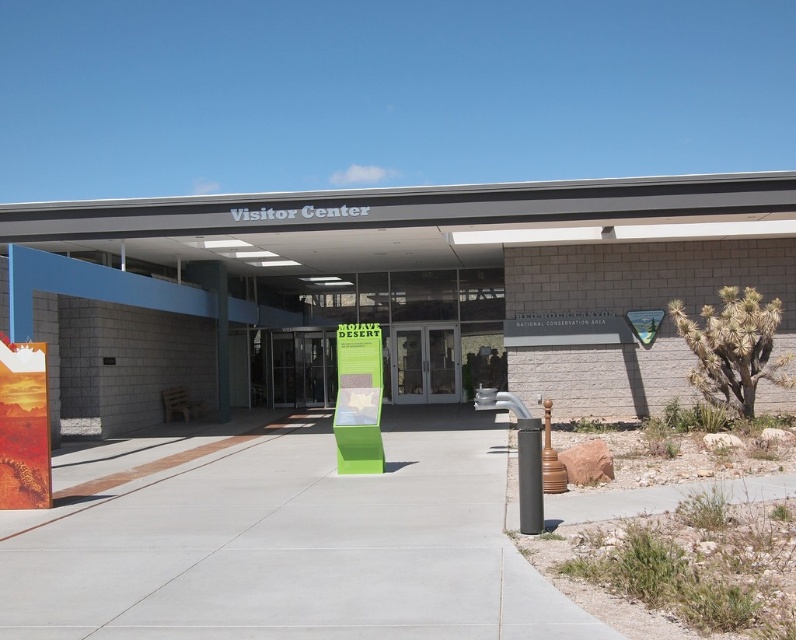
Can you confirm if clear glass doors at center is positioned above black smooth pole at lower right?

Yes.

Is point (404, 346) closer to viewer compared to point (521, 458)?

No.

The height and width of the screenshot is (640, 796). I want to click on clear glass doors at center, so click(424, 362).

Is point (80, 568) positioned behind point (420, 400)?

No, (80, 568) is in front of (420, 400).

Is gray concrete pavement at center further to camera compared to clear glass doors at center?

No, it is not.

Is point (184, 486) in front of point (412, 376)?

Yes, point (184, 486) is in front of point (412, 376).

Identify the location of gray concrete pavement at center. Image resolution: width=796 pixels, height=640 pixels. (281, 540).

Between gray concrete pavement at center and black smooth pole at lower right, which one is positioned higher?

black smooth pole at lower right is above.

Based on the photo, how distant is gray concrete pavement at center from black smooth pole at lower right?

They are 4.13 meters apart.

The height and width of the screenshot is (640, 796). What are the coordinates of `gray concrete pavement at center` in the screenshot? It's located at (281, 540).

I want to click on gray concrete pavement at center, so click(x=281, y=540).